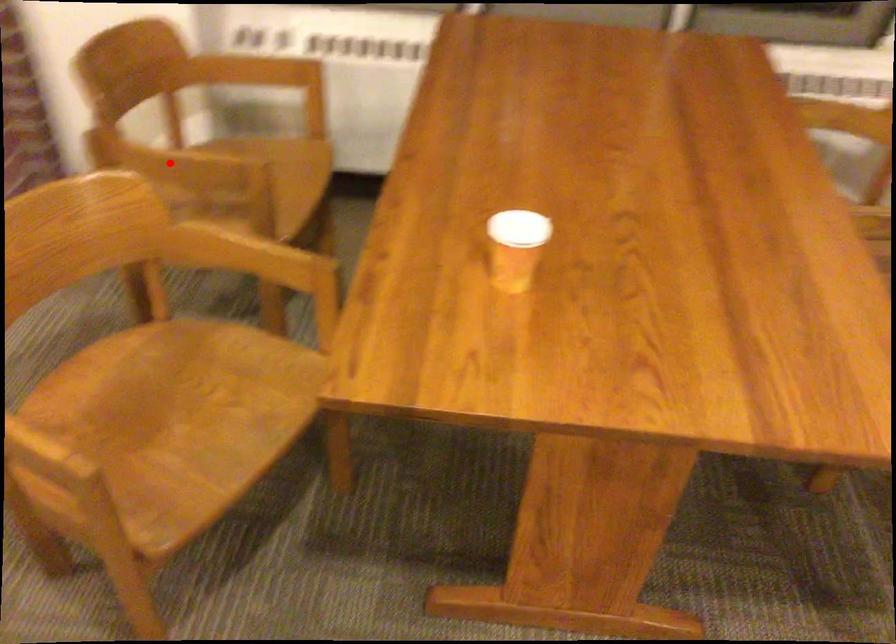
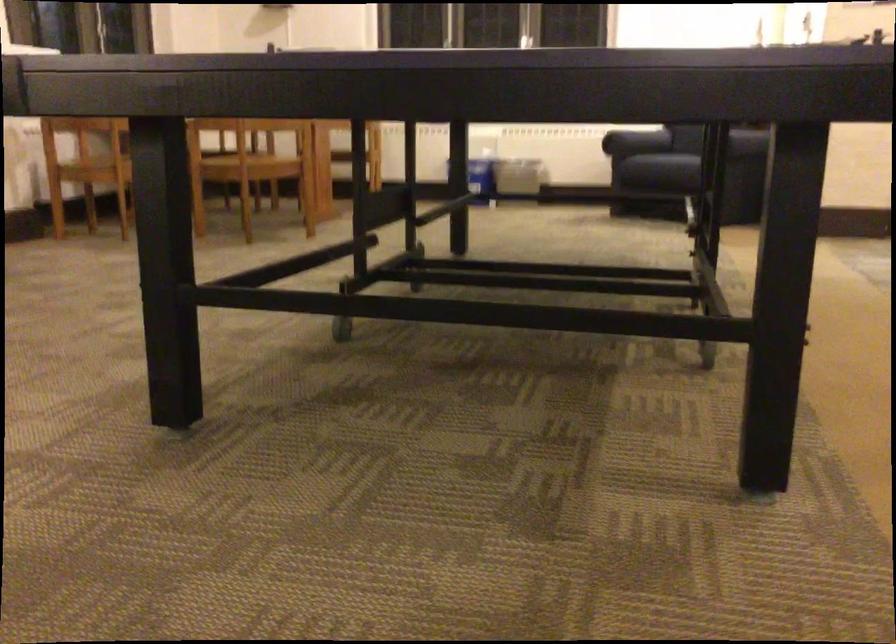
Question: I am providing you with two images of the same scene from different viewpoints. A red point is marked on the first image. Is the red point's position out of view in image 2?

Choices:
 (A) Yes
 (B) No

Answer: (A)